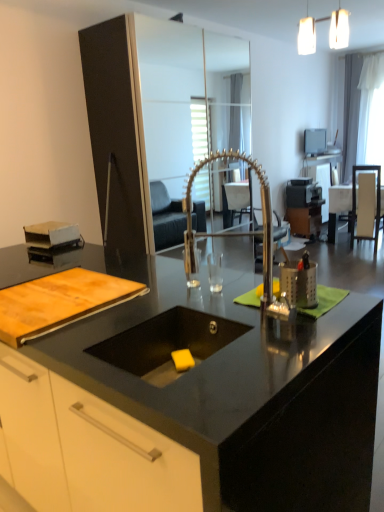
Image resolution: width=384 pixels, height=512 pixels. Describe the element at coordinates (358, 106) in the screenshot. I see `white sheer curtain at upper right` at that location.

What is the approximate height of black granite countertop at center?

black granite countertop at center is 36.39 inches tall.

The image size is (384, 512). What are the coordinates of `black glossy sink at center` in the screenshot? It's located at (167, 343).

What do you see at coordinates (167, 343) in the screenshot? This screenshot has height=512, width=384. I see `black glossy sink at center` at bounding box center [167, 343].

The image size is (384, 512). Describe the element at coordinates (329, 32) in the screenshot. I see `white matte light fixture at upper right` at that location.

At what (x,y) coordinates should I click in order to perform the action: click on matte black television at upper center. Please return your answer as a coordinate pair (x, y). The image size is (384, 512). Looking at the image, I should click on (315, 141).

Locate an element on the screen. This screenshot has height=512, width=384. white fabric armchair at right is located at coordinates (366, 203).

I want to click on white sheer curtain at upper right, so click(358, 106).

The height and width of the screenshot is (512, 384). What are the coordinates of `sink behind the black granite countertop at center` in the screenshot? It's located at (167, 343).

Is black glossy sink at center directly adjacent to black granite countertop at center?

No, black glossy sink at center is not next to black granite countertop at center.

From the image's perspective, which is below, black glossy sink at center or black granite countertop at center?

black granite countertop at center appears lower in the image.

Based on the photo, which is correct: black glossy sink at center is inside black granite countertop at center, or outside of it?

black glossy sink at center is contained in black granite countertop at center.

Is wooden cutting board at lower left located outside black granite countertop at center?

No, wooden cutting board at lower left is not outside of black granite countertop at center.

From the image's perspective, is wooden cutting board at lower left located above or below black granite countertop at center?

Clearly, from the image's perspective, wooden cutting board at lower left is above black granite countertop at center.

Is wooden cutting board at lower left in contact with black granite countertop at center?

wooden cutting board at lower left is not next to black granite countertop at center, and they're not touching.

Which object is further away from the camera, black granite countertop at center or white fabric armchair at right?

white fabric armchair at right is further from the camera.

Does black granite countertop at center have a greater width compared to white fabric armchair at right?

Indeed, black granite countertop at center has a greater width compared to white fabric armchair at right.

Between black granite countertop at center and white fabric armchair at right, which one appears on the left side from the viewer's perspective?

Positioned to the left is black granite countertop at center.

Which of these two, black granite countertop at center or white fabric armchair at right, stands taller?

With more height is white fabric armchair at right.

From the image's perspective, which one is positioned lower, black glossy sink at center or wooden table at right?

black glossy sink at center appears lower in the image.

In the image, is black glossy sink at center on the left side or the right side of wooden table at right?

black glossy sink at center is positioned on wooden table at right's left side.

Is point (195, 352) closer to camera compared to point (333, 204)?

That is True.

From the picture: Which of these two, black glossy sink at center or wooden table at right, stands taller?

Standing taller between the two is wooden table at right.

From a real-world perspective, is matte black television at upper center beneath white fabric armchair at right?

No.

Considering the sizes of objects matte black television at upper center and white fabric armchair at right in the image provided, who is taller, matte black television at upper center or white fabric armchair at right?

white fabric armchair at right is taller.

Is white fabric armchair at right at the back of matte black television at upper center?

No, matte black television at upper center is not facing the opposite direction of white fabric armchair at right.

From the image's perspective, which is above, matte black television at upper center or white fabric armchair at right?

matte black television at upper center is shown above in the image.

Who is taller, wooden cutting board at lower left or wooden table at right?

With more height is wooden table at right.

From the picture: Is wooden cutting board at lower left not close to wooden table at right?

Yes, wooden cutting board at lower left and wooden table at right are located far from each other.

Between point (109, 284) and point (338, 187), which one is positioned in front?

The point (109, 284) is closer to the camera.

From the image's perspective, between wooden cutting board at lower left and wooden table at right, who is located below?

From the image's view, wooden cutting board at lower left is below.

Is wooden cutting board at lower left completely or partially outside of polished metallic faucet at center?

Yes.

Can you tell me how much wooden cutting board at lower left and polished metallic faucet at center differ in facing direction?

179 degrees.

Is wooden cutting board at lower left facing towards polished metallic faucet at center?

No, wooden cutting board at lower left does not turn towards polished metallic faucet at center.

Considering the points (22, 294) and (268, 286), which point is in front, point (22, 294) or point (268, 286)?

The point (268, 286) is more forward.

I want to click on countertop located in front of the black glossy sink at center, so click(x=190, y=400).

Locate an element on the screen. The image size is (384, 512). cutting board on the left of the black granite countertop at center is located at coordinates (59, 302).

Looking at the image, which one is located closer to wooden cutting board at lower left, black granite countertop at center or wooden table at right?

black granite countertop at center is positioned closer to the anchor wooden cutting board at lower left.

When comparing their distances from matte black television at upper center, does black glossy sink at center or white sheer curtain at upper right seem further?

black glossy sink at center lies further to matte black television at upper center than the other object.

Which object lies further to the anchor point black glossy sink at center, polished metallic faucet at center or wooden cutting board at lower left?

polished metallic faucet at center lies further to black glossy sink at center than the other object.

Which object lies further to the anchor point wooden table at right, black glossy sink at center or black granite countertop at center?

The object further to wooden table at right is black granite countertop at center.

When comparing their distances from matte black television at upper center, does black granite countertop at center or wooden table at right seem further?

black granite countertop at center is positioned further to the anchor matte black television at upper center.

When comparing their distances from wooden cutting board at lower left, does black glossy sink at center or white fabric armchair at right seem further?

Based on the image, white fabric armchair at right appears to be further to wooden cutting board at lower left.

From the image, which object appears to be farther from white sheer curtain at upper right, polished metallic faucet at center or wooden cutting board at lower left?

wooden cutting board at lower left is positioned further to the anchor white sheer curtain at upper right.

Looking at the image, which one is located closer to wooden cutting board at lower left, polished metallic faucet at center or white sheer curtain at upper right?

polished metallic faucet at center is positioned closer to the anchor wooden cutting board at lower left.

At what (x,y) coordinates should I click in order to perform the action: click on faucet between black granite countertop at center and wooden table at right in the front-back direction. Please return your answer as a coordinate pair (x, y). This screenshot has height=512, width=384. Looking at the image, I should click on (258, 233).

Identify the location of light fixture located between wooden cutting board at lower left and white fabric armchair at right in the depth direction. The height and width of the screenshot is (512, 384). (329, 32).

Where is `armchair between white sheer curtain at upper right and wooden table at right vertically`? The width and height of the screenshot is (384, 512). armchair between white sheer curtain at upper right and wooden table at right vertically is located at coordinates (366, 203).

Identify the location of table positioned between black glossy sink at center and white sheer curtain at upper right from near to far. (338, 207).